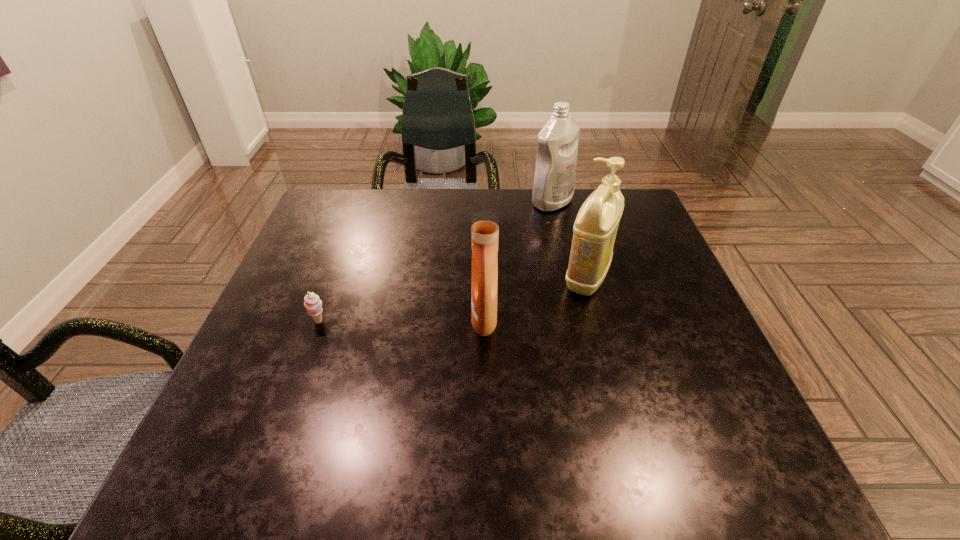
At what (x,y) coordinates should I click in order to perform the action: click on object that is positioned at the left edge. Please return your answer as a coordinate pair (x, y). Looking at the image, I should click on [x=312, y=303].

You are a GUI agent. You are given a task and a screenshot of the screen. Output one action in this format:
    pyautogui.click(x=<x>, y=<y>)
    Task: Click on the object present at the right edge
    
    Given the screenshot: What is the action you would take?
    pyautogui.click(x=595, y=228)

This screenshot has width=960, height=540. In order to click on vacant space at the far edge of the desktop in this screenshot , I will do `click(397, 189)`.

In the image, there is a desktop. What are the coordinates of `vacant space at the near edge` in the screenshot? It's located at (437, 449).

Where is `vacant area at the left edge`? vacant area at the left edge is located at coordinates (297, 273).

What are the coordinates of `free space at the right edge of the desktop` in the screenshot? It's located at (652, 359).

What are the coordinates of `vacant space at the far left corner` in the screenshot? It's located at (337, 195).

This screenshot has height=540, width=960. In the image, there is a desktop. Identify the location of free space at the near left corner. (188, 462).

The image size is (960, 540). In order to click on free space between the shortest object and the farthest object in this screenshot , I will do `click(436, 262)`.

Where is `free point between the second object from left to right and the farthest object`? This screenshot has width=960, height=540. free point between the second object from left to right and the farthest object is located at coordinates (518, 260).